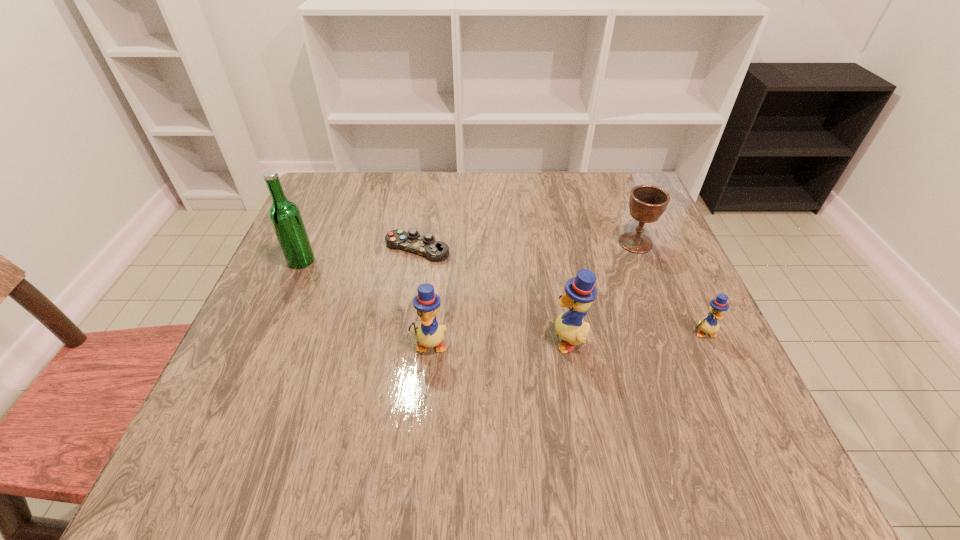
Image resolution: width=960 pixels, height=540 pixels. Identify the location of vacant position at the near edge of the desktop. (384, 416).

Locate an element on the screen. blank space at the left edge of the desktop is located at coordinates (258, 340).

This screenshot has height=540, width=960. In the image, there is a desktop. In order to click on vacant region at the right edge in this screenshot , I will do pyautogui.click(x=646, y=274).

You are a GUI agent. You are given a task and a screenshot of the screen. Output one action in this format:
    pyautogui.click(x=<x>, y=<y>)
    Task: Click on the vacant area at the far left corner
    The height and width of the screenshot is (540, 960).
    Given the screenshot: What is the action you would take?
    pyautogui.click(x=330, y=175)

You are a GUI agent. You are given a task and a screenshot of the screen. Output one action in this format:
    pyautogui.click(x=<x>, y=<y>)
    Task: Click on the vacant space at the near left corner
    The width and height of the screenshot is (960, 540).
    Given the screenshot: What is the action you would take?
    [271, 394]

Where is `free space at the far right corner of the desktop`? The width and height of the screenshot is (960, 540). free space at the far right corner of the desktop is located at coordinates (623, 202).

Find the location of a particular element. The image size is (960, 540). vacant region between the shortest object and the tallest object is located at coordinates (359, 255).

You are a GUI agent. You are given a task and a screenshot of the screen. Output one action in this format:
    pyautogui.click(x=<x>, y=<y>)
    Task: Click on the free spot between the control and the rightmost duckling
    The width and height of the screenshot is (960, 540).
    Given the screenshot: What is the action you would take?
    pyautogui.click(x=561, y=291)

Find the location of `free space between the leftmost object and the control`. free space between the leftmost object and the control is located at coordinates (359, 255).

Image resolution: width=960 pixels, height=540 pixels. Identify the location of unoccupied position between the second tallest duckling and the beer bottle. (366, 303).